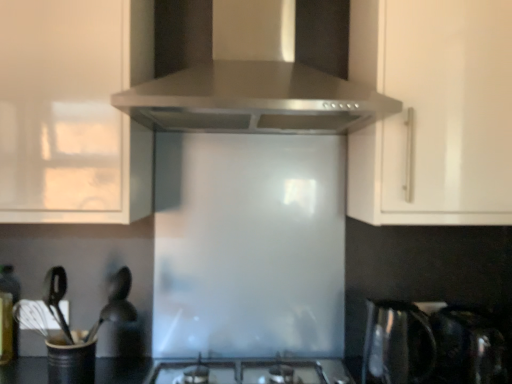
Question: Is the depth of satin metallic kettle at lower right less than that of satin silver gas stove at center?

Choices:
 (A) yes
 (B) no

Answer: (B)

Question: Can you confirm if satin metallic kettle at lower right is shorter than satin silver gas stove at center?

Choices:
 (A) yes
 (B) no

Answer: (B)

Question: Is satin metallic kettle at lower right far away from satin silver gas stove at center?

Choices:
 (A) yes
 (B) no

Answer: (B)

Question: Is satin metallic kettle at lower right beside satin silver gas stove at center?

Choices:
 (A) yes
 (B) no

Answer: (B)

Question: Is satin metallic kettle at lower right aimed at satin silver gas stove at center?

Choices:
 (A) yes
 (B) no

Answer: (B)

Question: Looking at their shapes, would you say satin silver range hood at upper center is wider or thinner than black matte utensil holder at lower left, which is the 1th appliance in left-to-right order?

Choices:
 (A) wide
 (B) thin

Answer: (A)

Question: In terms of height, does satin silver range hood at upper center look taller or shorter compared to black matte utensil holder at lower left, the 2th appliance viewed from the right?

Choices:
 (A) tall
 (B) short

Answer: (A)

Question: Choose the correct answer: Is satin silver range hood at upper center inside black matte utensil holder at lower left, the 2th appliance viewed from the right, or outside it?

Choices:
 (A) inside
 (B) outside

Answer: (B)

Question: Based on their sizes in the image, would you say satin silver range hood at upper center is bigger or smaller than black matte utensil holder at lower left, which is the 1th appliance in left-to-right order?

Choices:
 (A) big
 (B) small

Answer: (A)

Question: From the image's perspective, is white glossy cabinet at upper left, which is the second cabinetry in right-to-left order, positioned above or below black matte utensil holder at lower left, the 2th appliance viewed from the right?

Choices:
 (A) below
 (B) above

Answer: (B)

Question: Considering the positions of white glossy cabinet at upper left, which appears as the first cabinetry when viewed from the left, and black matte utensil holder at lower left, which is the 1th appliance in left-to-right order, in the image, is white glossy cabinet at upper left, which appears as the first cabinetry when viewed from the left, wider or thinner than black matte utensil holder at lower left, which is the 1th appliance in left-to-right order,?

Choices:
 (A) thin
 (B) wide

Answer: (B)

Question: Considering the relative positions of white glossy cabinet at upper left, which appears as the first cabinetry when viewed from the left, and black matte utensil holder at lower left, the 2th appliance viewed from the right, in the image provided, is white glossy cabinet at upper left, which appears as the first cabinetry when viewed from the left, to the left or to the right of black matte utensil holder at lower left, the 2th appliance viewed from the right,?

Choices:
 (A) right
 (B) left

Answer: (B)

Question: From their relative heights in the image, would you say white glossy cabinet at upper left, which is the second cabinetry in right-to-left order, is taller or shorter than black matte utensil holder at lower left, the 2th appliance viewed from the right?

Choices:
 (A) tall
 (B) short

Answer: (A)

Question: Looking at the image, does satin metallic kettle at lower right seem bigger or smaller compared to black matte utensil holder at lower left, the 2th appliance viewed from the right?

Choices:
 (A) small
 (B) big

Answer: (B)

Question: Relative to black matte utensil holder at lower left, the 2th appliance viewed from the right, is satin metallic kettle at lower right in front or behind?

Choices:
 (A) behind
 (B) front

Answer: (B)